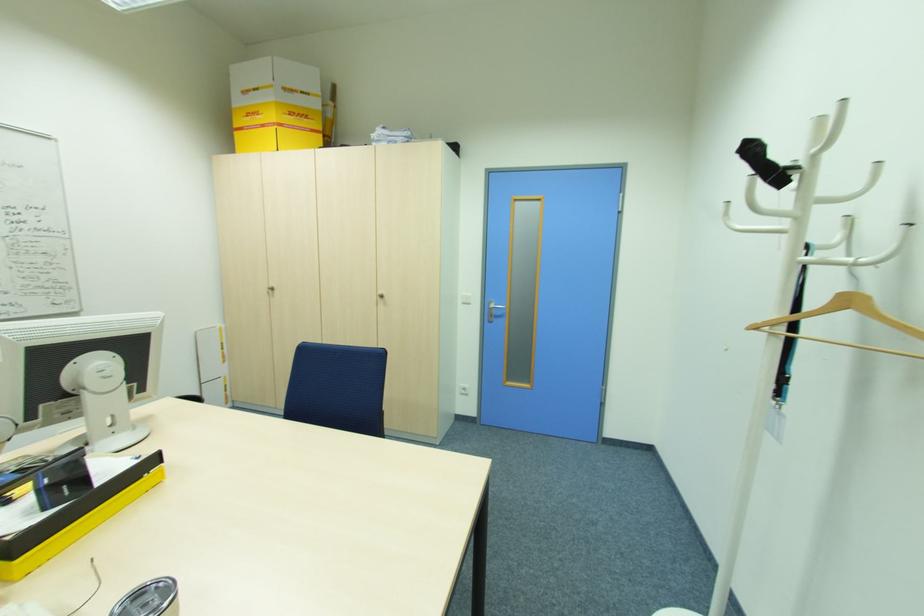
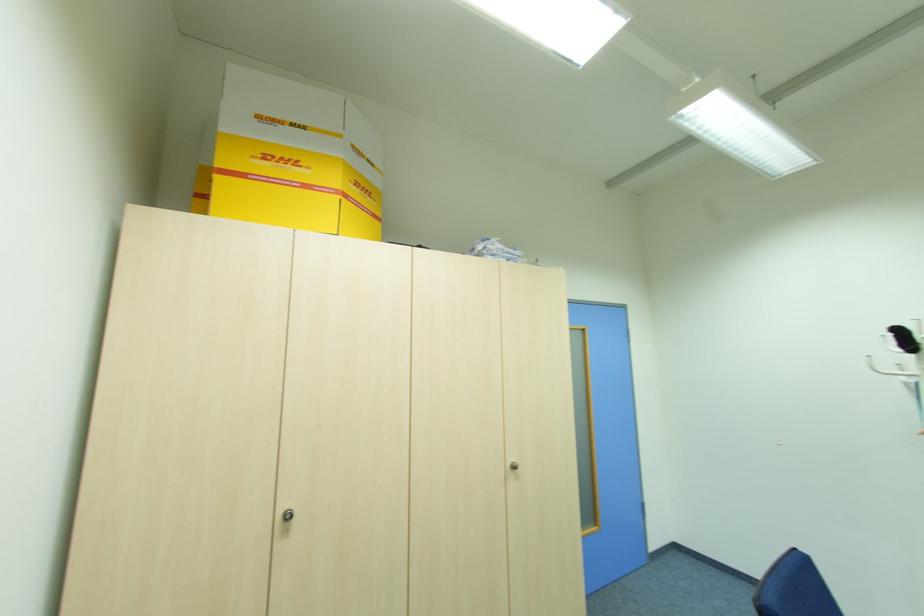
In the second image, find the point that corresponds to [294,114] in the first image.

(359, 185)